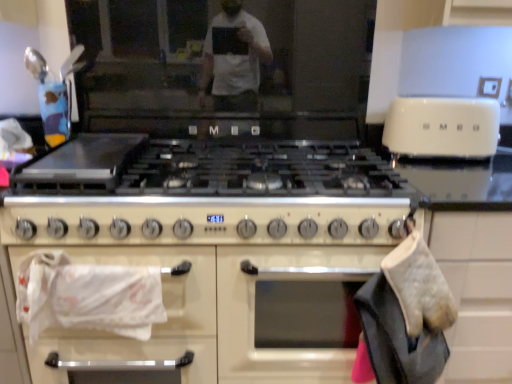
Question: Considering the positions of white glossy toaster at upper right and white glossy towel at lower left in the image, is white glossy toaster at upper right bigger or smaller than white glossy towel at lower left?

Choices:
 (A) big
 (B) small

Answer: (A)

Question: From the image's perspective, is white glossy toaster at upper right positioned above or below white glossy towel at lower left?

Choices:
 (A) above
 (B) below

Answer: (A)

Question: Considering the positions of white glossy toaster at upper right and white glossy towel at lower left in the image, is white glossy toaster at upper right taller or shorter than white glossy towel at lower left?

Choices:
 (A) short
 (B) tall

Answer: (A)

Question: From the image's perspective, relative to white glossy toaster at upper right, is white glossy towel at lower left above or below?

Choices:
 (A) below
 (B) above

Answer: (A)

Question: Is point (163, 259) closer or farther from the camera than point (472, 135)?

Choices:
 (A) farther
 (B) closer

Answer: (B)

Question: Is white glossy towel at lower left situated inside white glossy toaster at upper right or outside?

Choices:
 (A) inside
 (B) outside

Answer: (B)

Question: From a real-world perspective, is white glossy towel at lower left above or below white glossy toaster at upper right?

Choices:
 (A) above
 (B) below

Answer: (B)